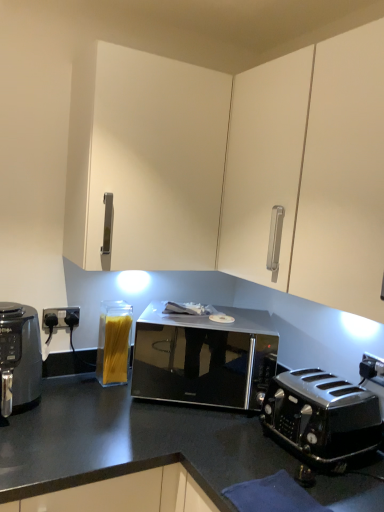
Question: Is black matte air fryer at left in front of or behind black glossy microwave at center in the image?

Choices:
 (A) front
 (B) behind

Answer: (A)

Question: Is point (16, 321) closer or farther from the camera than point (162, 330)?

Choices:
 (A) closer
 (B) farther

Answer: (A)

Question: Estimate the real-world distances between objects in this image. Which object is farther from the black plastic electrical outlet at lower right?

Choices:
 (A) black matte air fryer at left
 (B) black glossy microwave at center
 (C) clear glass container of spaghetti at lower left
 (D) white matte cabinet at upper center
 (E) polished black toaster at lower right

Answer: (A)

Question: Estimate the real-world distances between objects in this image. Which object is closer to the black glossy microwave at center?

Choices:
 (A) polished black toaster at lower right
 (B) black matte air fryer at left
 (C) clear glass container of spaghetti at lower left
 (D) black plastic electrical outlet at lower right
 (E) white matte cabinet at upper center

Answer: (C)